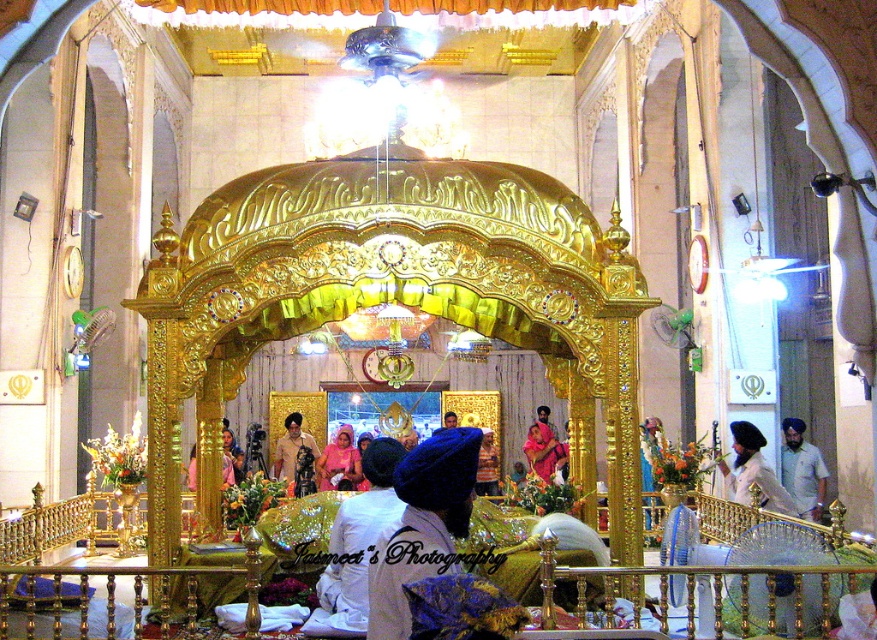
You are attending a ceremony at the Gurdwara and notice two items at the center of the platform. The blue fabric turban at center and the matte pink dress at center. Which item takes up more space on the platform?

The blue fabric turban at center is bigger than the matte pink dress at center, so it takes up more space on the platform.

You are attending a ceremony at the Gurdwara and notice two items at the center of the platform. The blue fabric turban at center and the matte pink dress at center. Which item is wider?

The blue fabric turban at center is wider than the matte pink dress at center.

From the picture: You are standing in the Gurdwara and see the white satin turban at center. If you move 0.1 units to the right along the horizontal axis, will you be closer to the turban?

The white satin turban at center is located at point 0.853 on the x axis. Moving 0.1 units to the right would take you to 0.953 on the x axis, which is further away from the turban. Therefore, you will not be closer to the turban.